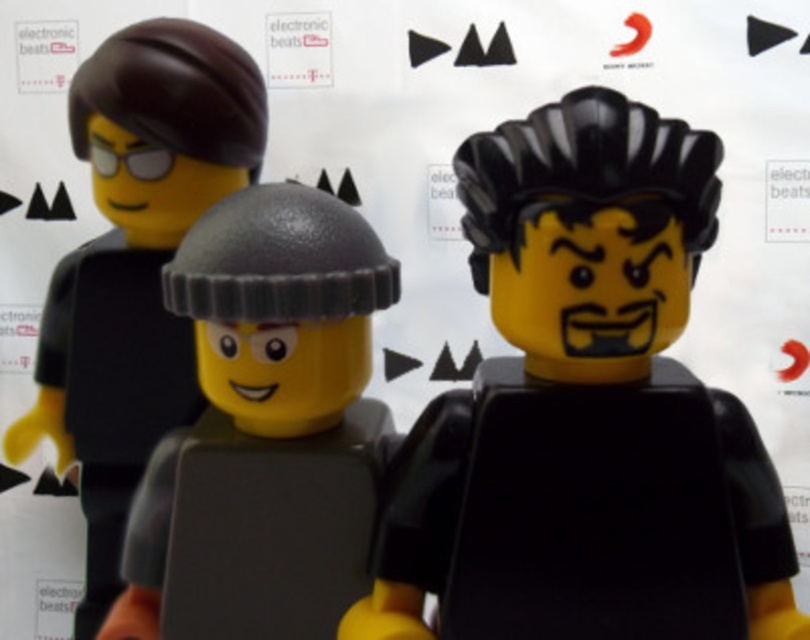
Between matte black helmet at left and matte gray helmet at center, which one has more height?

Standing taller between the two is matte black helmet at left.

Is point (122, 138) farther from camera compared to point (128, 628)?

Yes.

Is point (122, 92) positioned behind point (313, 376)?

Yes.

You are a GUI agent. You are given a task and a screenshot of the screen. Output one action in this format:
    pyautogui.click(x=<x>, y=<y>)
    Task: Click on the matte black helmet at left
    This screenshot has height=640, width=810.
    Given the screenshot: What is the action you would take?
    pyautogui.click(x=134, y=266)

Which is behind, point (437, 532) or point (181, 364)?

Positioned behind is point (181, 364).

Is matte black helmet at center thinner than matte black helmet at left?

No.

Which is in front, point (480, 248) or point (81, 436)?

Positioned in front is point (480, 248).

What are the coordinates of `matte black helmet at center` in the screenshot? It's located at (583, 410).

Can you confirm if matte black helmet at center is positioned above matte gray helmet at center?

Indeed, matte black helmet at center is positioned over matte gray helmet at center.

Does matte black helmet at center have a lesser width compared to matte gray helmet at center?

No.

Identify the location of matte black helmet at center. (583, 410).